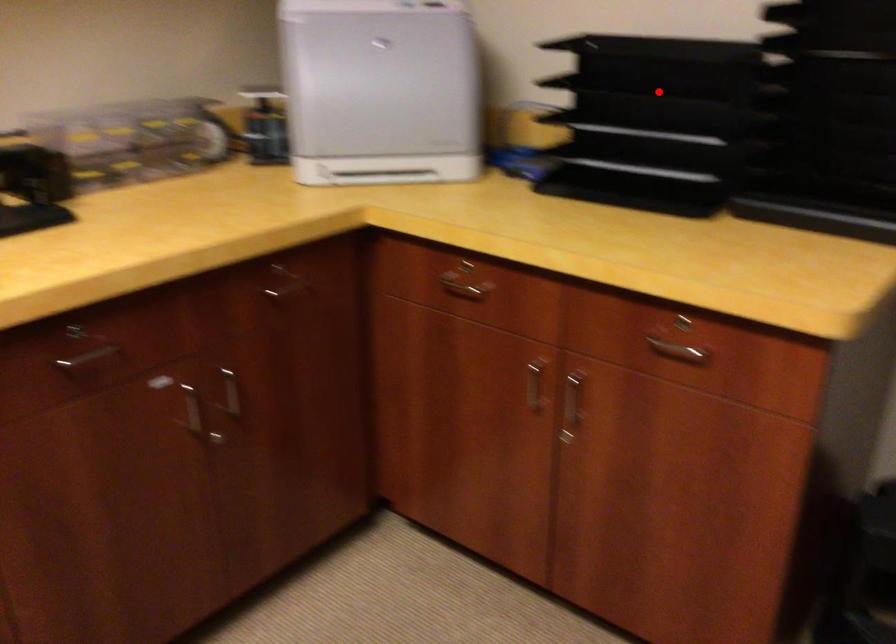
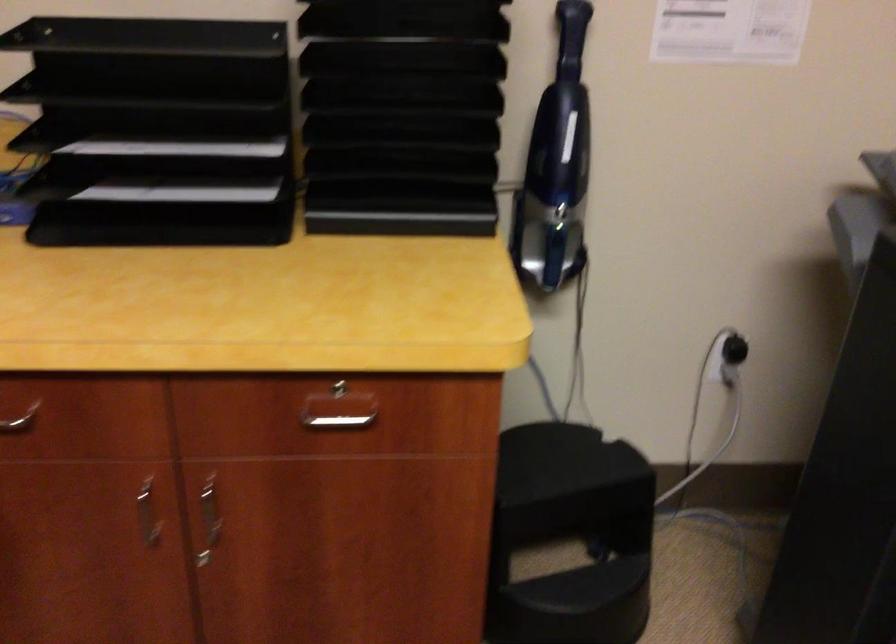
Question: I am providing you with two images of the same scene from different viewpoints. In image1, a red point is highlighted. Considering the same 3D point in image2, which of the following is correct?

Choices:
 (A) It is closer
 (B) It is farther

Answer: (A)